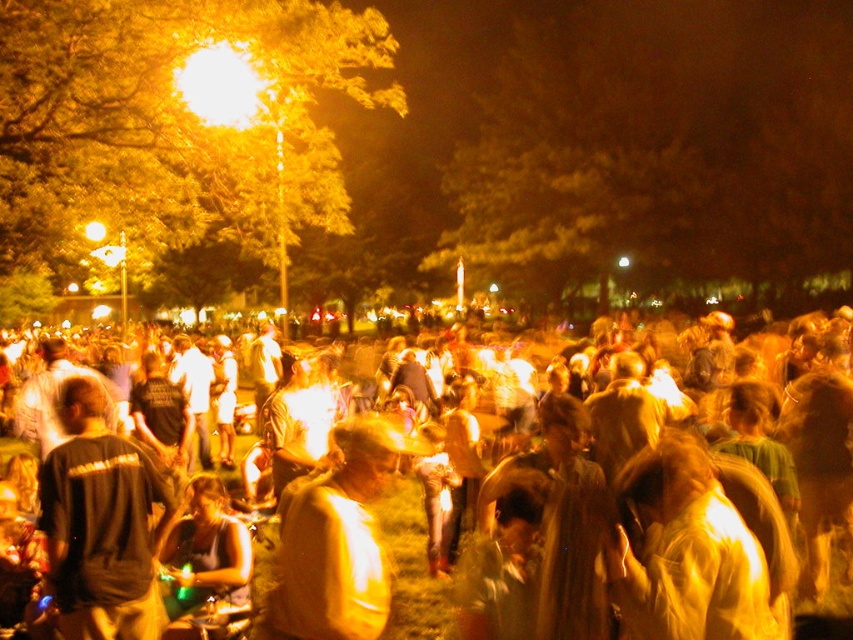
Question: Based on their relative distances, which object is farther from the yellowish fabric crowd at center?

Choices:
 (A) shiny gold jacket at center
 (B) black matte shirt at center

Answer: (B)

Question: Which point is farther to the camera?

Choices:
 (A) shiny gold jacket at center
 (B) black matte shirt at center

Answer: (B)

Question: Can you confirm if yellowish fabric crowd at center is positioned above shiny gold jacket at center?

Choices:
 (A) no
 (B) yes

Answer: (A)

Question: Which object is positioned closest to the yellowish fabric crowd at center?

Choices:
 (A) black matte shirt at center
 (B) shiny gold jacket at center

Answer: (B)

Question: Does yellowish fabric crowd at center have a larger size compared to black matte shirt at center?

Choices:
 (A) no
 (B) yes

Answer: (B)

Question: Is black matte shirt at center smaller than shiny gold jacket at center?

Choices:
 (A) no
 (B) yes

Answer: (B)